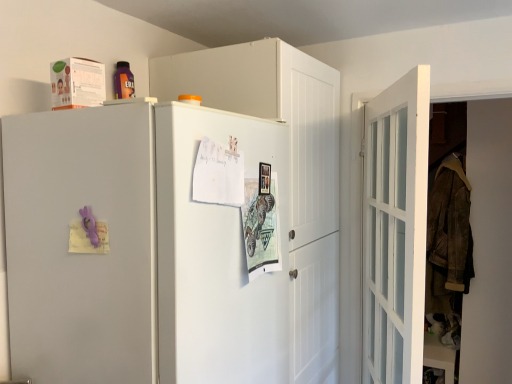
Question: Is white glossy door at right surrounding white matte refrigerator at upper left?

Choices:
 (A) no
 (B) yes

Answer: (A)

Question: From a real-world perspective, is white glossy door at right beneath white matte refrigerator at upper left?

Choices:
 (A) no
 (B) yes

Answer: (A)

Question: Considering the relative sizes of white glossy door at right and white matte refrigerator at upper left in the image provided, is white glossy door at right smaller than white matte refrigerator at upper left?

Choices:
 (A) no
 (B) yes

Answer: (B)

Question: Could you tell me if white glossy door at right is turned towards white matte refrigerator at upper left?

Choices:
 (A) yes
 (B) no

Answer: (B)

Question: Considering the relative sizes of white glossy door at right and white matte refrigerator at upper left in the image provided, is white glossy door at right taller than white matte refrigerator at upper left?

Choices:
 (A) no
 (B) yes

Answer: (B)

Question: Does point (184, 365) appear closer or farther from the camera than point (371, 301)?

Choices:
 (A) closer
 (B) farther

Answer: (A)

Question: In terms of width, does white matte refrigerator at upper left look wider or thinner when compared to white glossy door at right?

Choices:
 (A) thin
 (B) wide

Answer: (B)

Question: Is white matte refrigerator at upper left in front of or behind white glossy door at right in the image?

Choices:
 (A) front
 (B) behind

Answer: (A)

Question: From a real-world perspective, is white matte refrigerator at upper left physically located above or below white glossy door at right?

Choices:
 (A) below
 (B) above

Answer: (A)

Question: Considering their positions, is white matte cabinet at upper center located in front of or behind white matte refrigerator at upper left?

Choices:
 (A) behind
 (B) front

Answer: (A)

Question: Is white matte cabinet at upper center situated inside white matte refrigerator at upper left or outside?

Choices:
 (A) outside
 (B) inside

Answer: (A)

Question: Based on their sizes in the image, would you say white matte cabinet at upper center is bigger or smaller than white matte refrigerator at upper left?

Choices:
 (A) big
 (B) small

Answer: (A)

Question: Based on their positions, is white matte cabinet at upper center located to the left or right of white matte refrigerator at upper left?

Choices:
 (A) left
 (B) right

Answer: (B)

Question: Is white matte cabinet at upper center taller or shorter than white glossy door at right?

Choices:
 (A) short
 (B) tall

Answer: (B)

Question: Would you say white matte cabinet at upper center is inside or outside white glossy door at right?

Choices:
 (A) outside
 (B) inside

Answer: (A)